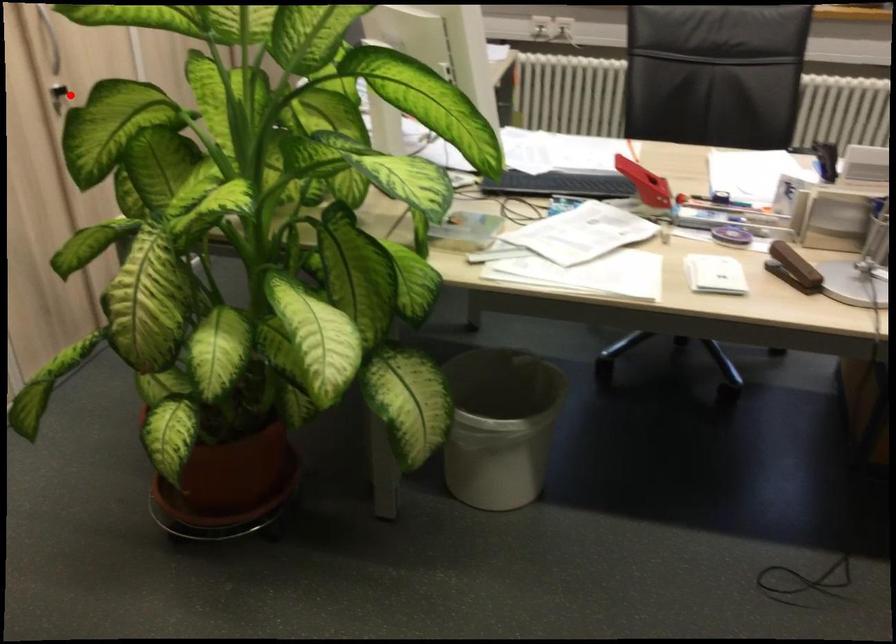
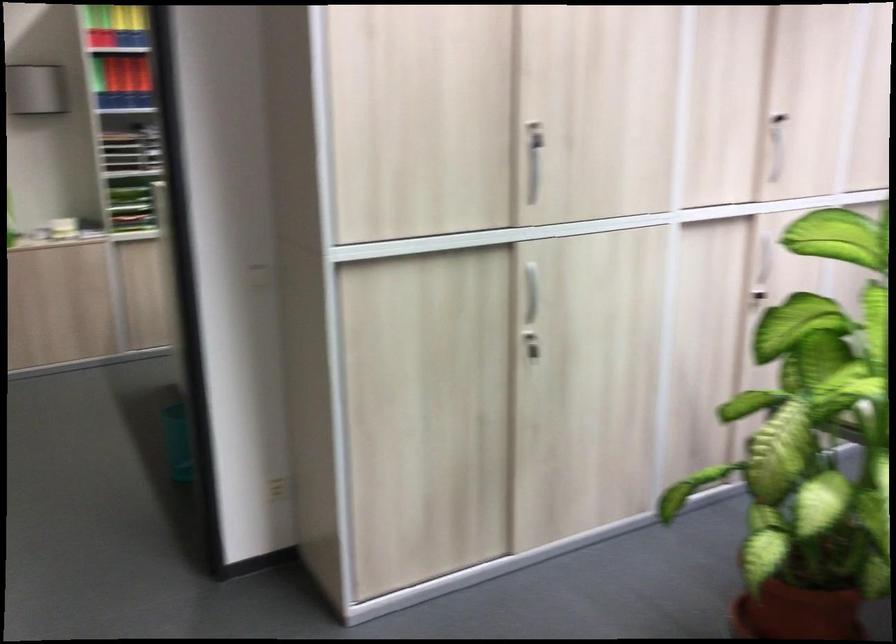
Locate, in the second image, the point that corresponds to the highlighted location in the first image.

(759, 299)